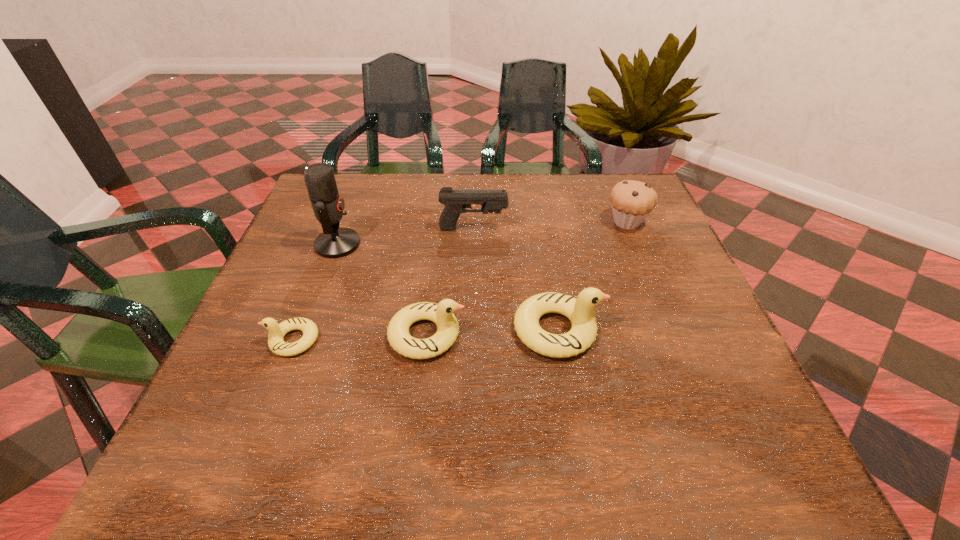
I want to click on free space at the left edge of the desktop, so click(x=262, y=333).

Locate an element on the screen. vacant space at the right edge is located at coordinates [684, 342].

Where is `free point at the far left corner`? free point at the far left corner is located at coordinates (354, 195).

Find the location of a particular element. This screenshot has height=540, width=960. vacant space at the near left corner of the desktop is located at coordinates (274, 411).

In the image, there is a desktop. What are the coordinates of `vacant area at the far right corner` in the screenshot? It's located at (636, 179).

The image size is (960, 540). Find the location of `vacant area at the near right corner of the desktop`. vacant area at the near right corner of the desktop is located at coordinates (741, 395).

The height and width of the screenshot is (540, 960). I want to click on vacant point located between the rightmost duckling and the pistol, so click(x=516, y=279).

Image resolution: width=960 pixels, height=540 pixels. Identify the location of unoccupied area between the rightmost duckling and the microphone. (447, 287).

Locate an element on the screen. The width and height of the screenshot is (960, 540). empty location between the second duckling from left to right and the rightmost duckling is located at coordinates (492, 332).

Locate an element on the screen. The height and width of the screenshot is (540, 960). vacant area that lies between the muffin and the pistol is located at coordinates (550, 226).